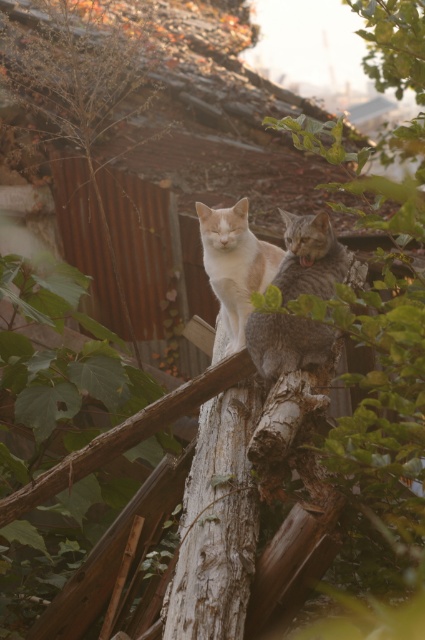
Does white textured wood at center have a smaller size compared to gray textured cat at center?

Incorrect, white textured wood at center is not smaller in size than gray textured cat at center.

At what (x,y) coordinates should I click in order to perform the action: click on white textured wood at center. Please return your answer as a coordinate pair (x, y). Looking at the image, I should click on pyautogui.click(x=217, y=524).

Does smooth brown wood at center come in front of white fur cat at center?

Yes.

Is smooth brown wood at center to the left of white fur cat at center from the viewer's perspective?

Indeed, smooth brown wood at center is positioned on the left side of white fur cat at center.

Is point (161, 410) less distant than point (240, 244)?

Yes, point (161, 410) is in front of point (240, 244).

The image size is (425, 640). Find the location of `smooth brown wood at center`. smooth brown wood at center is located at coordinates (127, 435).

How far apart are gray textured cat at center and smooth brown wood at center?

The distance of gray textured cat at center from smooth brown wood at center is 56.61 centimeters.

The width and height of the screenshot is (425, 640). I want to click on gray textured cat at center, so click(309, 257).

Who is more forward, (255, 344) or (25, 509)?

Point (25, 509)

What are the coordinates of `gray textured cat at center` in the screenshot? It's located at (309, 257).